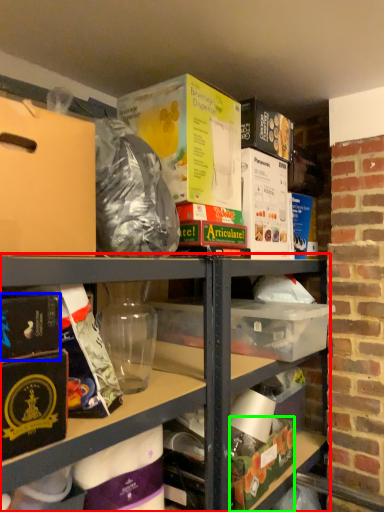
Question: Which is nearer to the shelf (highlighted by a red box)? paperback book (highlighted by a blue box) or box (highlighted by a green box).

Choices:
 (A) paperback book
 (B) box

Answer: (B)